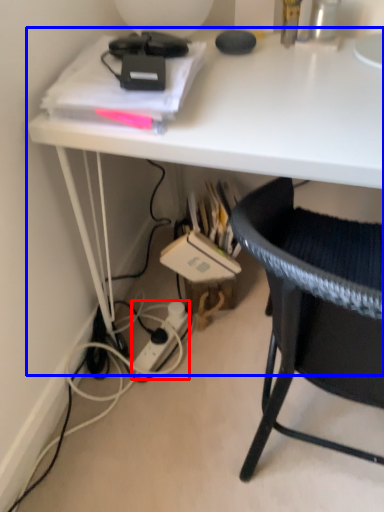
Question: Which object is further to the camera taking this photo, power outlet (highlighted by a red box) or desk (highlighted by a blue box)?

Choices:
 (A) power outlet
 (B) desk

Answer: (A)